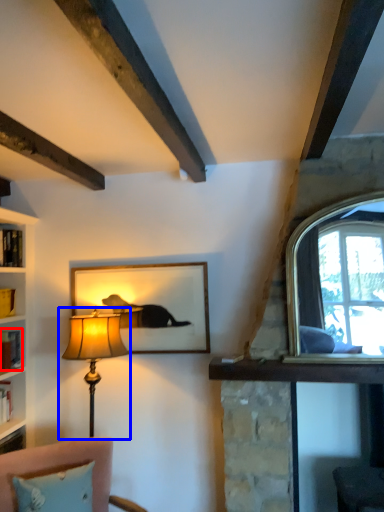
Question: Which object is closer to the camera taking this photo, book (highlighted by a red box) or lamp (highlighted by a blue box)?

Choices:
 (A) book
 (B) lamp

Answer: (B)